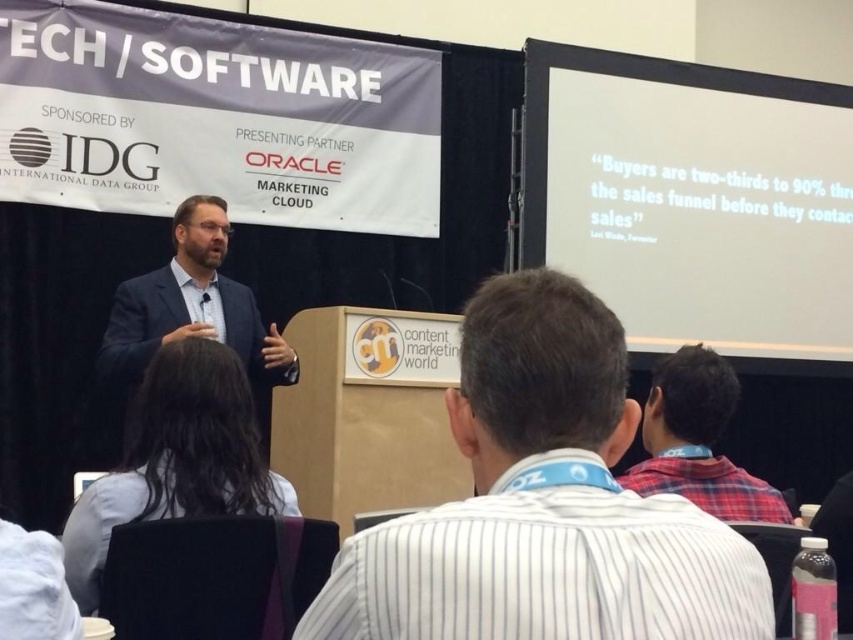
You are organizing a photo shoot and need to place a large banner behind the speaker. The banner requires a clear space that is at least 2 meters wide. Based on the positions of the white striped shirt at center and the red plaid shirt at upper right, can you determine if the space between them is wide enough for the banner?

The white striped shirt at center might be wider than red plaid shirt at upper right. However, without exact measurements, it is uncertain if the space between them is at least 2 meters wide. You should verify the actual distance before placing the banner.

You are an attendee at the conference and want to sit next to the person in the matte blue suit at center. Where should you move to relative to the light blue shirt at lower left?

You should move to the left side of the light blue shirt at lower left because the light blue shirt at lower left is positioned to the right of the matte blue suit at center, meaning the matte blue suit at center is to the left of the light blue shirt at lower left.

You are a photographer at the event and need to capture a photo of both the matte blue suit at center and the red plaid shirt at upper right in the same frame. The camera you are using has a maximum focus range of 6 feet. Can you fit both subjects within the focus range?

The distance between the matte blue suit at center and the red plaid shirt at upper right is 6.03 feet, which exceeds the camera focus range of 6 feet. Therefore, you cannot fit both subjects within the focus range.